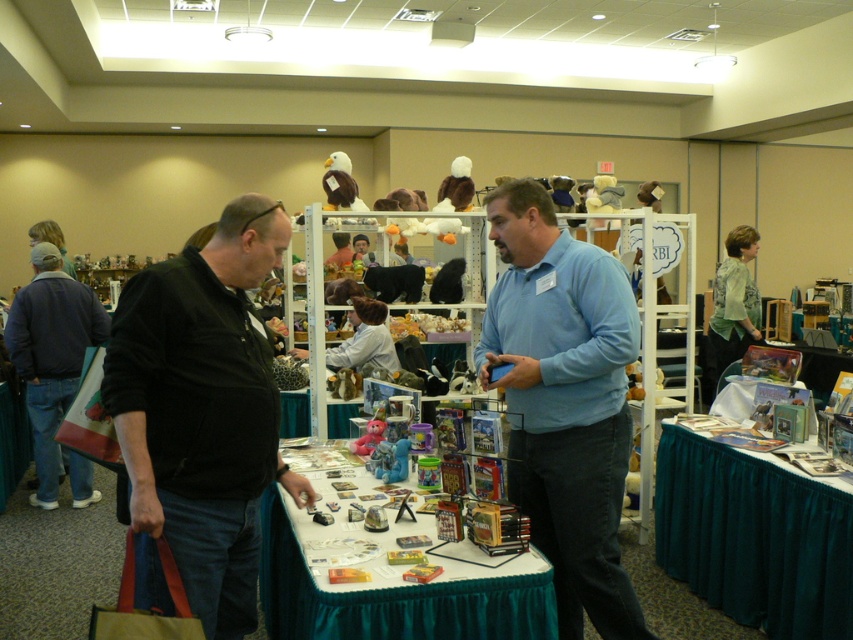
You are a photographer standing at the back of the convention hall. You want to take a photo of the blue cotton shirt at center and the white plush eagle at upper center. Which object should you focus on first to ensure both are in frame?

The blue cotton shirt at center is taller than the white plush eagle at upper center, so you should focus on the blue cotton shirt at center first to ensure both are in frame.

You are organizing a booth at the convention and need to decide where to place promotional materials. The black corduroy jacket at left is currently occupying space on the table. Can you fit the blue rubber toy at center next to it without moving the jacket?

The black corduroy jacket at left is bigger than the blue rubber toy at center, so there might not be enough space to place the promotional materials next to the jacket without moving it.

You are trying to place a new item on the table between the black corduroy jacket at left and the blue rubber toy at center. Is there enough space between them for the item?

The black corduroy jacket at left might be wider than the blue rubber toy at center, so there may not be enough space between them for the new item.